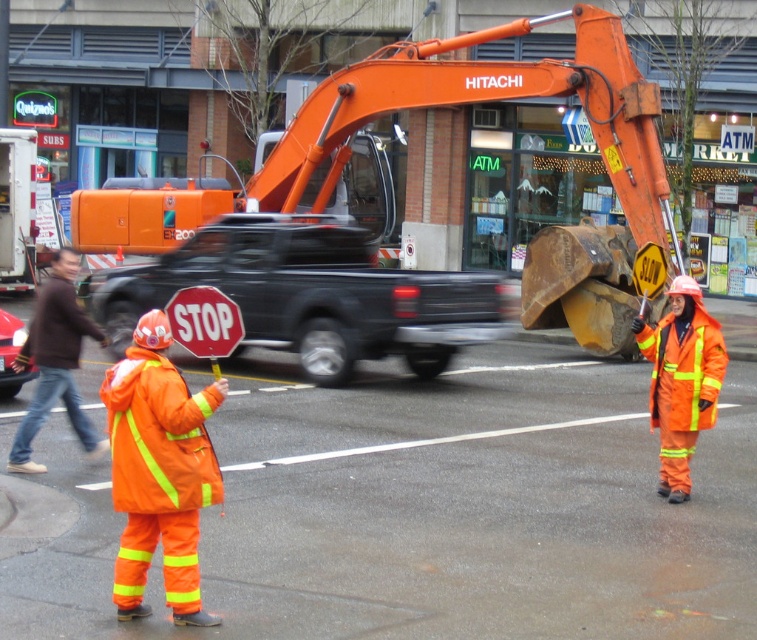
You are a traffic controller at the construction site. You need to direct a delivery truck to park in a safe area. Based on the scene, can the black matte truck at center move out of the way so the shiny red car at left can exit?

The black matte truck at center is positioned over the shiny red car at left, so the shiny red car at left cannot exit until the black matte truck at center moves first.

You are standing at the construction site and want to locate the orange metallic excavator at center. Where exactly is it positioned?

The orange metallic excavator at center is positioned at point (488, 100).